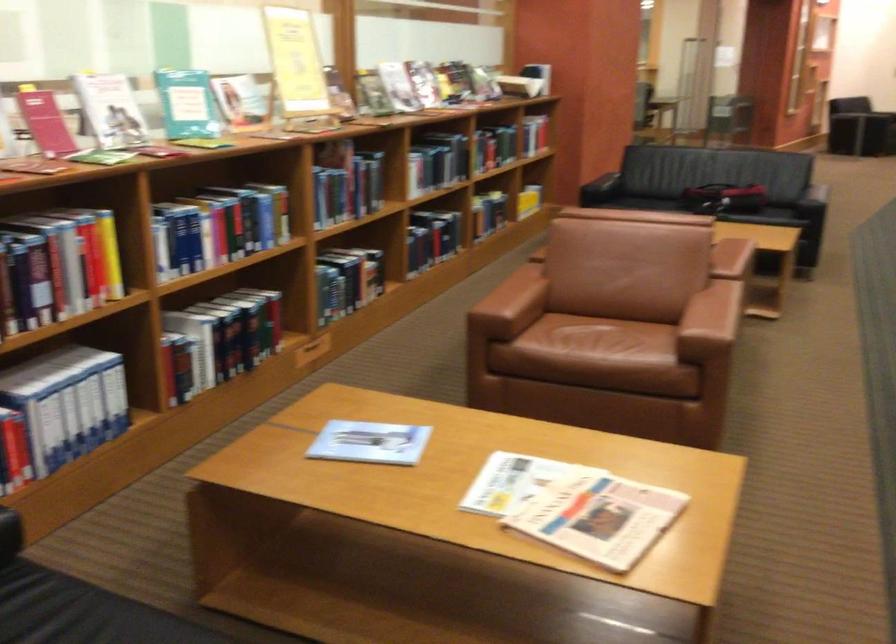
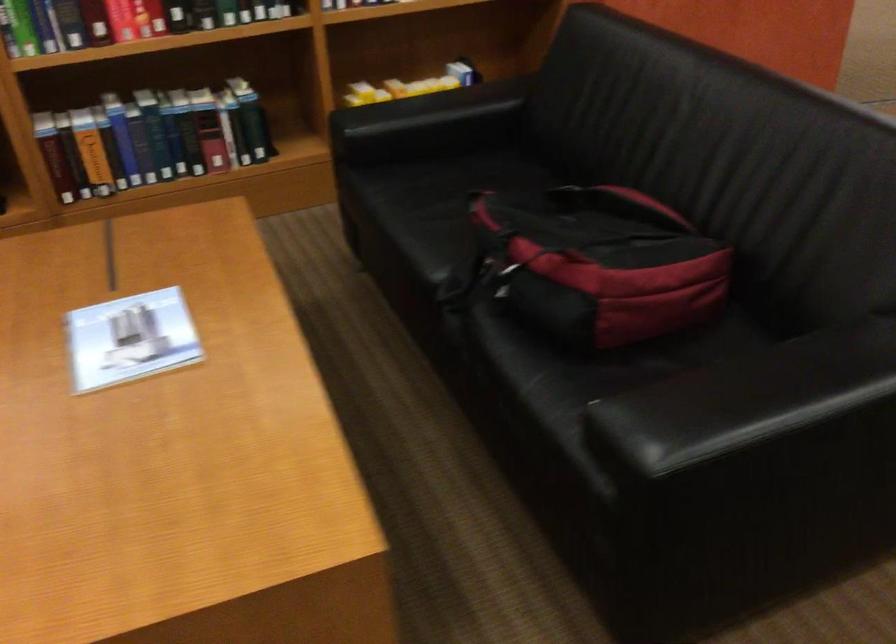
Find the pixel in the second image that matches [717,194] in the first image.

(495, 277)